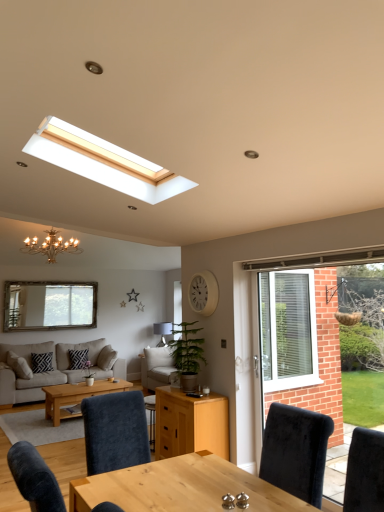
Question: Looking at their shapes, would you say white matte clock at upper center is wider or thinner than black textured pillow at lower left, the second pillow viewed from the right?

Choices:
 (A) wide
 (B) thin

Answer: (B)

Question: Based on their positions, is white matte clock at upper center located to the left or right of black textured pillow at lower left, the 1th pillow from the left?

Choices:
 (A) right
 (B) left

Answer: (A)

Question: Which is nearer to the beige fabric couch at lower left?

Choices:
 (A) light beige fabric couch at center
 (B) metallic silver lampshade at center
 (C) gold metallic chandelier at upper left
 (D) wooden table at center
 (E) white matte clock at upper center

Answer: (A)

Question: Estimate the real-world distances between objects in this image. Which object is farther from the matte glass mirror at upper left?

Choices:
 (A) gold metallic chandelier at upper left
 (B) metallic silver lampshade at center
 (C) light brown wooden coffee table at center
 (D) white matte clock at upper center
 (E) black textured pillow at center, the second pillow viewed from the left

Answer: (D)